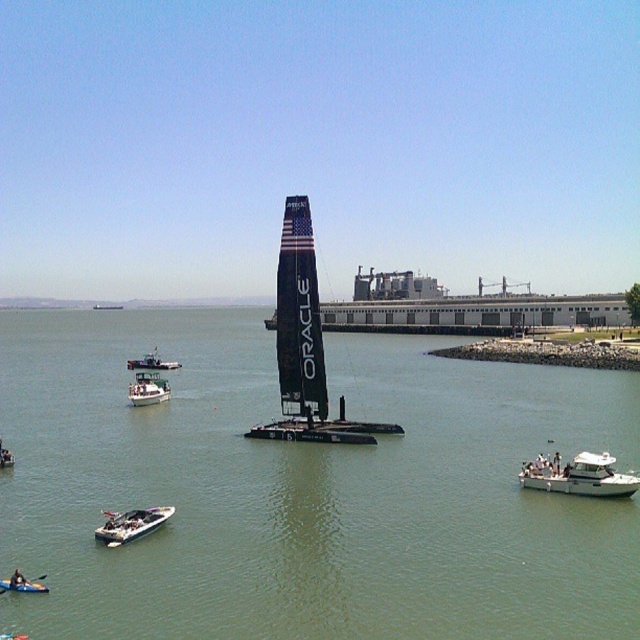
Is point (612, 472) positioned behind point (19, 582)?

Yes, it is.

From the picture: Can you confirm if white glossy boat at lower right is positioned to the left of dark blue wetsuit at lower left?

In fact, white glossy boat at lower right is to the right of dark blue wetsuit at lower left.

Is point (609, 484) farther from camera compared to point (17, 570)?

Yes, point (609, 484) is behind point (17, 570).

Locate an element on the screen. Image resolution: width=640 pixels, height=640 pixels. white glossy boat at lower right is located at coordinates (579, 476).

Who is positioned more to the right, white plastic kayak at center or white glossy kayak at lower left?

white plastic kayak at center

Who is positioned more to the left, white plastic kayak at center or white glossy kayak at lower left?

Positioned to the left is white glossy kayak at lower left.

Is point (8, 588) positioned before point (163, 364)?

Yes, it is.

At what (x,y) coordinates should I click in order to perform the action: click on white plastic kayak at center. Please return your answer as a coordinate pair (x, y). This screenshot has height=640, width=640. Looking at the image, I should click on (22, 584).

Between greenish water at center and black matte sailboat at center, which one has more height?

black matte sailboat at center

Which is in front, point (115, 324) or point (371, 433)?

Positioned in front is point (371, 433).

Identify the location of greenish water at center. (305, 490).